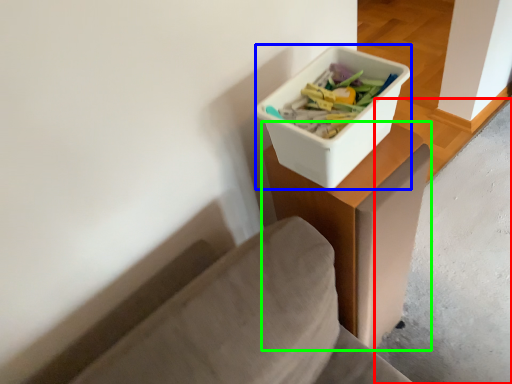
Question: Which object is positioned closest to concrete (highlighted by a red box)? Select from storage box (highlighted by a blue box) and table (highlighted by a green box).

Choices:
 (A) storage box
 (B) table

Answer: (B)